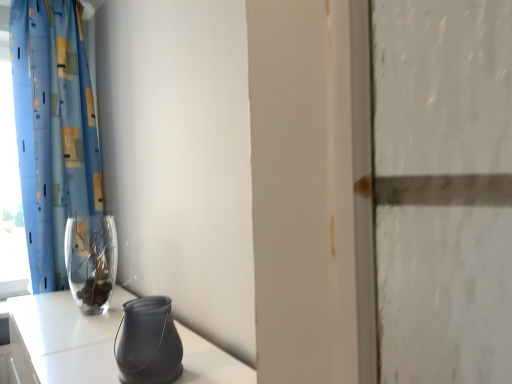
Question: Is matte black vase at lower center, which is counted as the first vase, starting from the right, inside or outside of transparent glass window at left?

Choices:
 (A) inside
 (B) outside

Answer: (B)

Question: Is matte black vase at lower center, positioned as the 2th vase in back-to-front order, in front of or behind transparent glass window at left in the image?

Choices:
 (A) front
 (B) behind

Answer: (A)

Question: Considering the real-world distances, which object is farthest from the matte black vase at lower center, which appears as the second vase when viewed from the left?

Choices:
 (A) blue printed fabric curtain at left
 (B) transparent glass window at left
 (C) transparent glass vase at left, the 1th vase in the left-to-right sequence

Answer: (B)

Question: Which of these objects is positioned closest to the transparent glass window at left?

Choices:
 (A) transparent glass vase at left, the 1th vase from the back
 (B) matte black vase at lower center, the 1th vase in the front-to-back sequence
 (C) blue printed fabric curtain at left

Answer: (C)